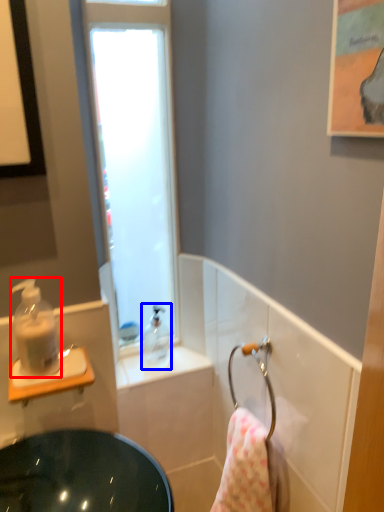
Question: Among these objects, which one is nearest to the camera, soap dispenser (highlighted by a red box) or soap dispenser (highlighted by a blue box)?

Choices:
 (A) soap dispenser
 (B) soap dispenser

Answer: (A)